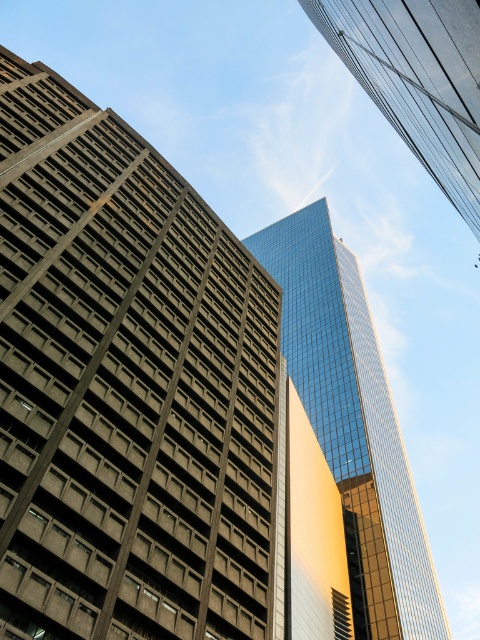
Question: Observing the image, what is the correct spatial positioning of gray concrete building at left in reference to glassy reflective skyscraper at upper center?

Choices:
 (A) right
 (B) left

Answer: (B)

Question: Which object is positioned farthest from the gray concrete building at left?

Choices:
 (A) glassy reflective skyscraper at center
 (B) glassy reflective skyscraper at upper center

Answer: (A)

Question: Is glassy reflective skyscraper at center to the right of glassy reflective skyscraper at upper center from the viewer's perspective?

Choices:
 (A) no
 (B) yes

Answer: (B)

Question: Estimate the real-world distances between objects in this image. Which object is farther from the glassy reflective skyscraper at upper center?

Choices:
 (A) gray concrete building at left
 (B) glassy reflective skyscraper at center

Answer: (B)

Question: Does glassy reflective skyscraper at center have a greater width compared to glassy reflective skyscraper at upper center?

Choices:
 (A) yes
 (B) no

Answer: (A)

Question: Which object is farther from the camera taking this photo?

Choices:
 (A) glassy reflective skyscraper at center
 (B) glassy reflective skyscraper at upper center

Answer: (A)